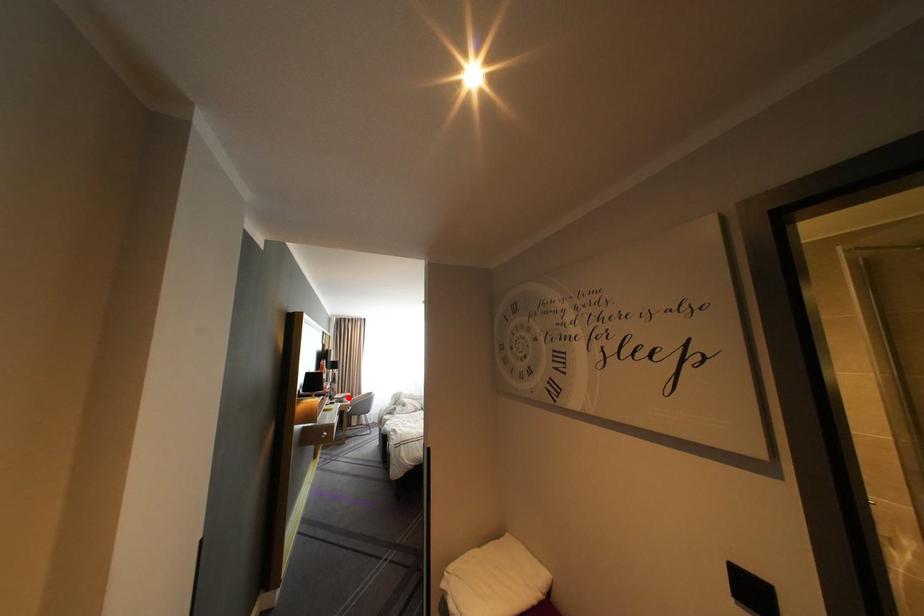
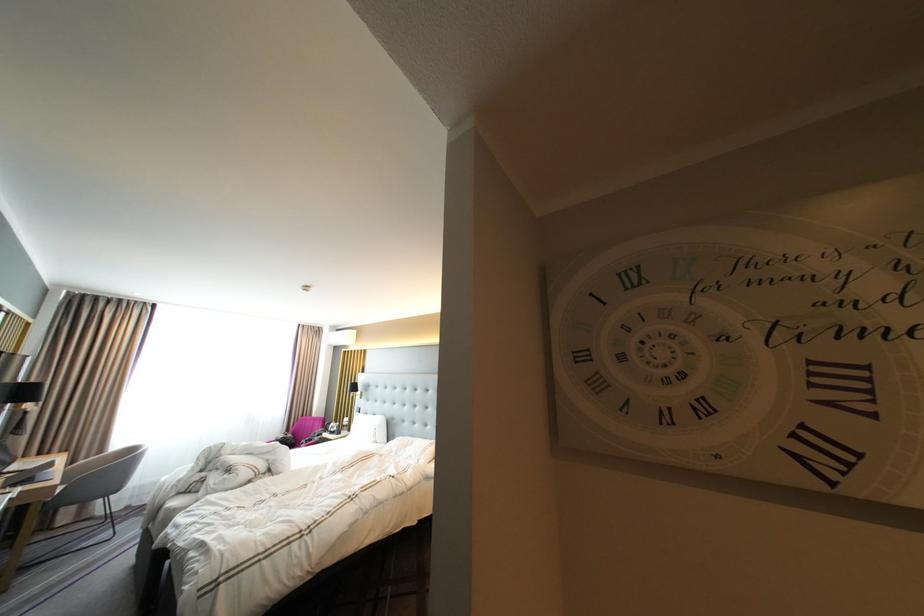
Question: A red point is marked in image1. In image2, is the corresponding 3D point closer to the camera or farther? Reply with the corresponding letter.

Choices:
 (A) The corresponding 3D point is closer.
 (B) The corresponding 3D point is farther.

Answer: (B)